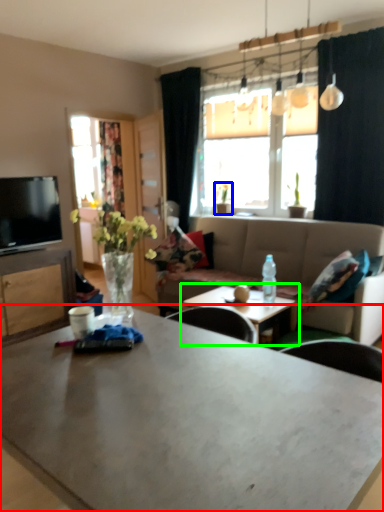
Question: Considering the real-world distances, which object is farthest from coffee table (highlighted by a red box)? houseplant (highlighted by a blue box) or coffee table (highlighted by a green box)?

Choices:
 (A) houseplant
 (B) coffee table

Answer: (A)